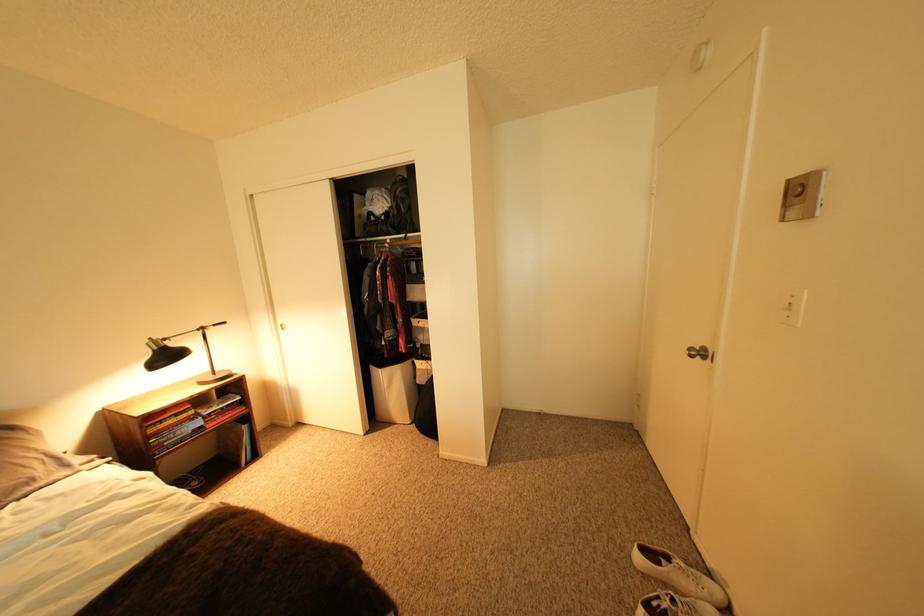
The width and height of the screenshot is (924, 616). I want to click on recessed door pull, so click(x=698, y=352).